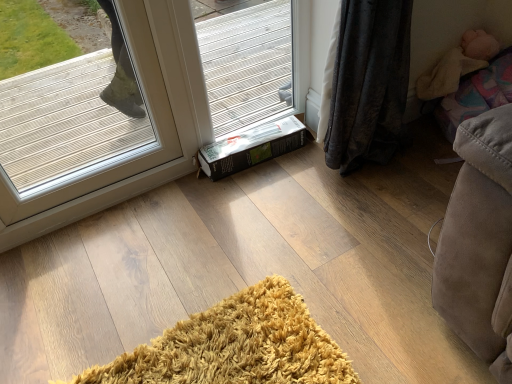
Where is `transparent glass door at lower left`? The height and width of the screenshot is (384, 512). transparent glass door at lower left is located at coordinates (85, 121).

What do you see at coordinates (85, 121) in the screenshot?
I see `transparent glass door at lower left` at bounding box center [85, 121].

The image size is (512, 384). I want to click on transparent glass door at lower left, so click(85, 121).